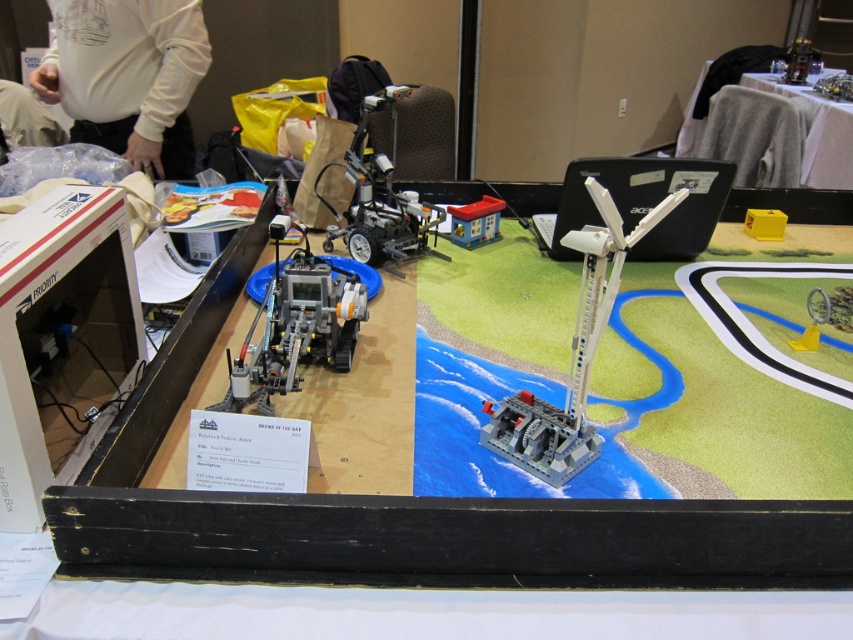
Who is more distant from viewer, (190,141) or (338,288)?

The point (190,141) is more distant.

Does white matte shirt at upper left have a greater height compared to matte black robot at center?

Indeed, white matte shirt at upper left has a greater height compared to matte black robot at center.

Locate an element on the screen. The width and height of the screenshot is (853, 640). white matte shirt at upper left is located at coordinates (126, 76).

I want to click on white matte shirt at upper left, so click(x=126, y=76).

Which is below, translucent gray wind turbine at center or matte black wheelchair at center?

translucent gray wind turbine at center is below.

How distant is translucent gray wind turbine at center from matte black wheelchair at center?

translucent gray wind turbine at center and matte black wheelchair at center are 26.46 inches apart from each other.

Is point (587, 445) behind point (350, 253)?

No.

You are a GUI agent. You are given a task and a screenshot of the screen. Output one action in this format:
    pyautogui.click(x=<x>, y=<y>)
    Task: Click on the translucent gray wind turbine at center
    The height and width of the screenshot is (640, 853).
    Given the screenshot: What is the action you would take?
    pyautogui.click(x=572, y=353)

Is translucent gray wind turbine at center thinner than white fabric table at upper right?

Yes, translucent gray wind turbine at center is thinner than white fabric table at upper right.

Based on the photo, is translucent gray wind turbine at center wider than white fabric table at upper right?

No, translucent gray wind turbine at center is not wider than white fabric table at upper right.

Between point (572, 397) and point (769, 154), which one is positioned in front?

Point (572, 397)

Where is `translucent gray wind turbine at center`? The width and height of the screenshot is (853, 640). translucent gray wind turbine at center is located at coordinates (572, 353).